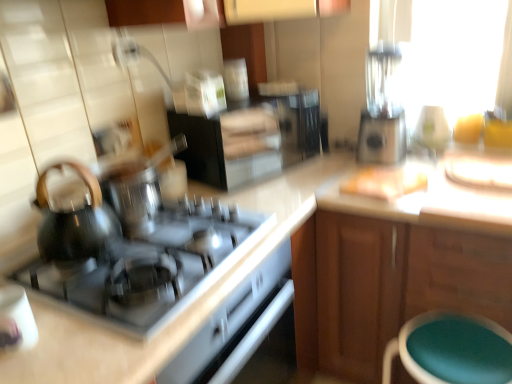
Question: From the image's perspective, is teal fabric stool at lower right located above or below sleek silver blender at upper right?

Choices:
 (A) below
 (B) above

Answer: (A)

Question: Considering the positions of teal fabric stool at lower right and sleek silver blender at upper right in the image, is teal fabric stool at lower right bigger or smaller than sleek silver blender at upper right?

Choices:
 (A) big
 (B) small

Answer: (A)

Question: Which of these objects is positioned closest to the teal fabric stool at lower right?

Choices:
 (A) wooden cabinet at right
 (B) shiny black cooktop at center-left
 (C) sleek silver blender at upper right
 (D) shiny black kettle at left

Answer: (A)

Question: Estimate the real-world distances between objects in this image. Which object is farther from the wooden cabinet at right?

Choices:
 (A) sleek silver blender at upper right
 (B) shiny black cooktop at center-left
 (C) teal fabric stool at lower right
 (D) shiny black kettle at left

Answer: (D)